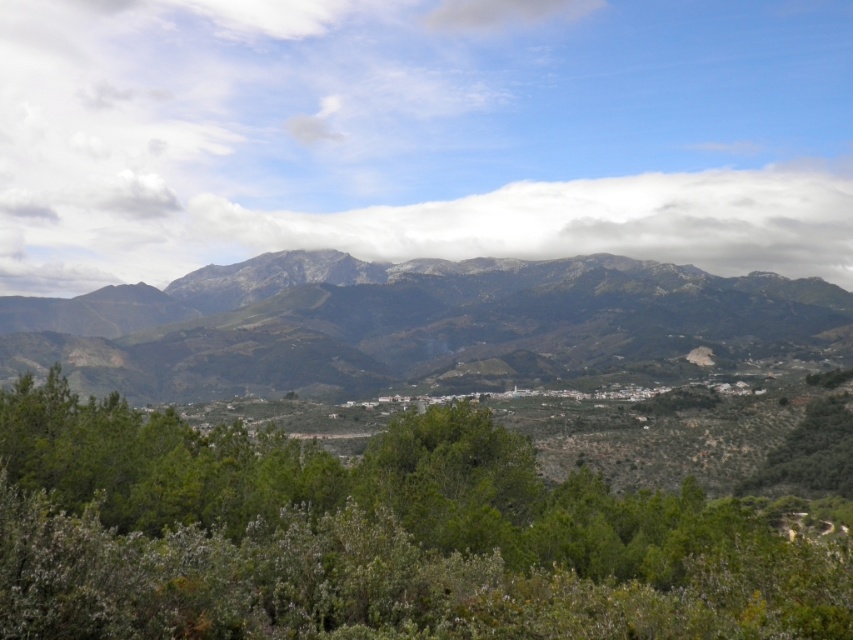
You are a hiker standing at the base of the mountain. You see a green leafy tree at center and a white fluffy cloud at center. Which object is closer to the camera?

The green leafy tree at center is closer to the camera than the white fluffy cloud at center because it is shorter than the cloud.

You are a hiker standing at the base of the rocky gray mountain range at center. You see a green leafy tree at center in front of you. Which object is closer to you?

The green leafy tree at center is closer to you than the rocky gray mountain range at center because it is positioned below it in the image.

You are an airplane passenger looking out the window. You see the rocky gray mountain range at center and the white fluffy cloud at center. Which one appears wider from your view?

The white fluffy cloud at center appears wider because its width is greater than the rocky gray mountain range at center.